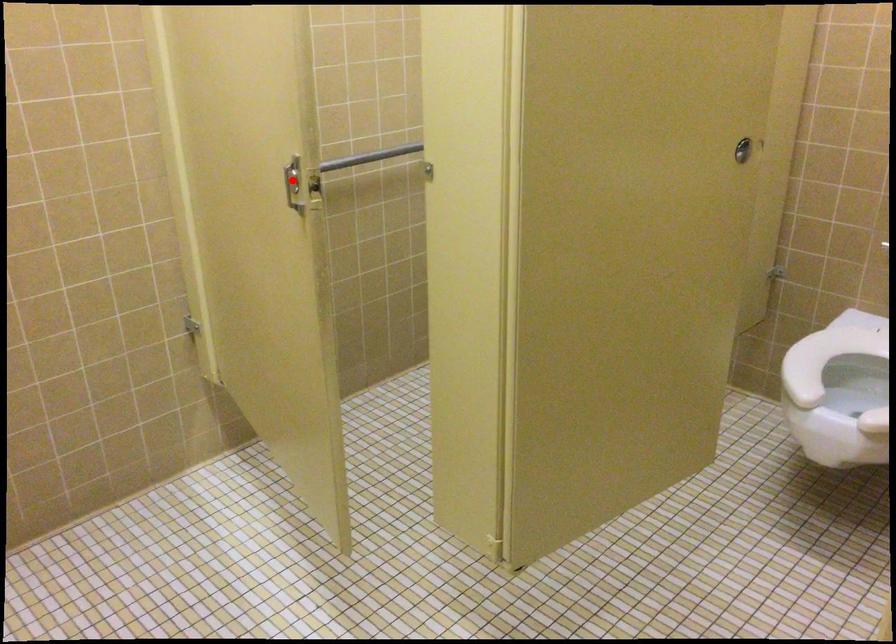
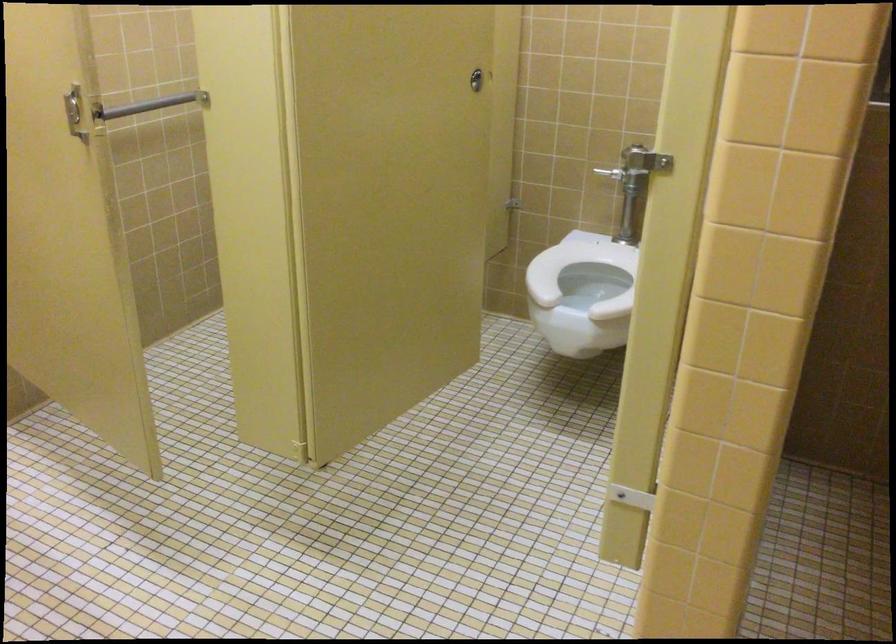
Where in the second image is the point corresponding to the highlighted location from the first image?

(74, 111)